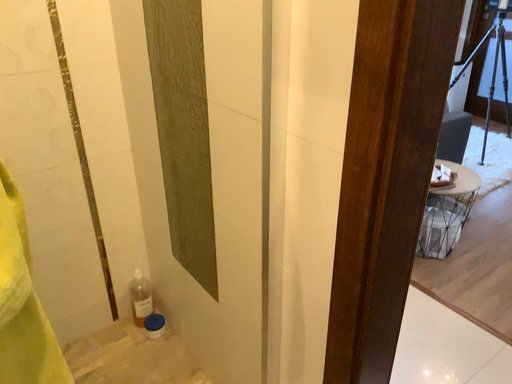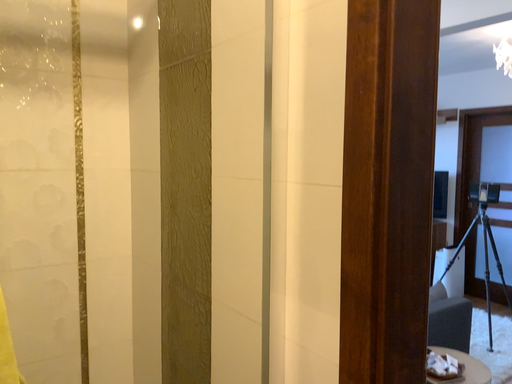
Question: Which way did the camera rotate in the video?

Choices:
 (A) rotated downward
 (B) rotated upward

Answer: (B)